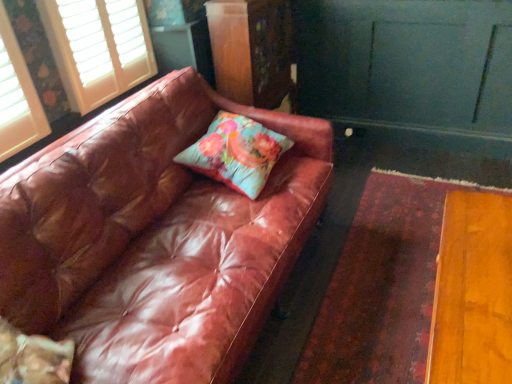
Question: Could you tell me if leather couch at left is turned towards white wood blinds at upper left?

Choices:
 (A) no
 (B) yes

Answer: (A)

Question: Can you confirm if leather couch at left is shorter than white wood blinds at upper left?

Choices:
 (A) yes
 (B) no

Answer: (B)

Question: Can you confirm if leather couch at left is taller than white wood blinds at upper left?

Choices:
 (A) yes
 (B) no

Answer: (A)

Question: Can you confirm if leather couch at left is positioned to the left of white wood blinds at upper left?

Choices:
 (A) no
 (B) yes

Answer: (A)

Question: Is leather couch at left positioned before white wood blinds at upper left?

Choices:
 (A) yes
 (B) no

Answer: (A)

Question: Does point (x=156, y=294) appear closer or farther from the camera than point (x=119, y=82)?

Choices:
 (A) closer
 (B) farther

Answer: (A)

Question: Considering the positions of leather couch at left and white wood blinds at upper left in the image, is leather couch at left bigger or smaller than white wood blinds at upper left?

Choices:
 (A) big
 (B) small

Answer: (A)

Question: Is leather couch at left in front of or behind white wood blinds at upper left in the image?

Choices:
 (A) behind
 (B) front

Answer: (B)

Question: Considering the positions of leather couch at left and white wood blinds at upper left in the image, is leather couch at left wider or thinner than white wood blinds at upper left?

Choices:
 (A) wide
 (B) thin

Answer: (A)

Question: From the image's perspective, is wooden dresser at center above or below white wood blinds at upper left?

Choices:
 (A) above
 (B) below

Answer: (A)

Question: From a real-world perspective, relative to white wood blinds at upper left, is wooden dresser at center vertically above or below?

Choices:
 (A) below
 (B) above

Answer: (A)

Question: Looking at their shapes, would you say wooden dresser at center is wider or thinner than white wood blinds at upper left?

Choices:
 (A) thin
 (B) wide

Answer: (B)

Question: In terms of size, does wooden dresser at center appear bigger or smaller than white wood blinds at upper left?

Choices:
 (A) small
 (B) big

Answer: (B)

Question: Would you say floral fabric cushion at center is to the left or to the right of wooden dresser at center in the picture?

Choices:
 (A) right
 (B) left

Answer: (B)

Question: From a real-world perspective, is floral fabric cushion at center above or below wooden dresser at center?

Choices:
 (A) below
 (B) above

Answer: (A)